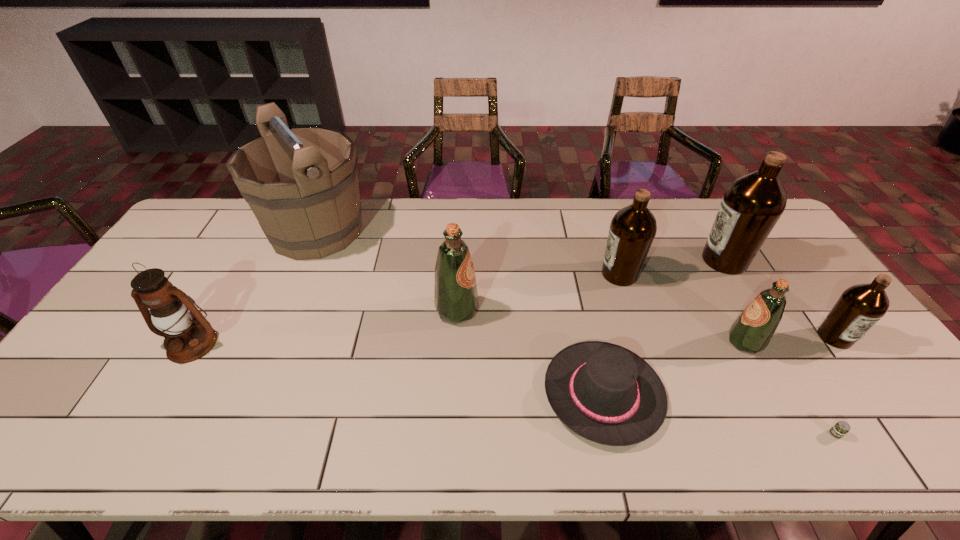
Image resolution: width=960 pixels, height=540 pixels. In order to click on the rightmost object in this screenshot , I will do `click(861, 306)`.

I want to click on the rightmost olive oil, so click(x=861, y=306).

The image size is (960, 540). What are the coordinates of `black dress hat` in the screenshot? It's located at (606, 393).

Identify the location of the second shortest object. The width and height of the screenshot is (960, 540). (606, 393).

Find the location of a particular element. This screenshot has height=540, width=960. beer can is located at coordinates (841, 428).

Locate an element on the screen. This screenshot has height=540, width=960. blank space located on the right of the bucket is located at coordinates (405, 231).

Find the location of `free space located on the label of the second brown olive oil from left to right`. free space located on the label of the second brown olive oil from left to right is located at coordinates (657, 260).

Find the location of a particular element. Image resolution: width=960 pixels, height=540 pixels. free spot located 0.390m on the label of the second brown olive oil from left to right is located at coordinates (579, 260).

The width and height of the screenshot is (960, 540). I want to click on free spot located 0.080m on the label of the second brown olive oil from left to right, so (x=675, y=260).

Find the location of a particular element. blank space located 0.250m on the front-facing side of the leftmost olive oil is located at coordinates (565, 310).